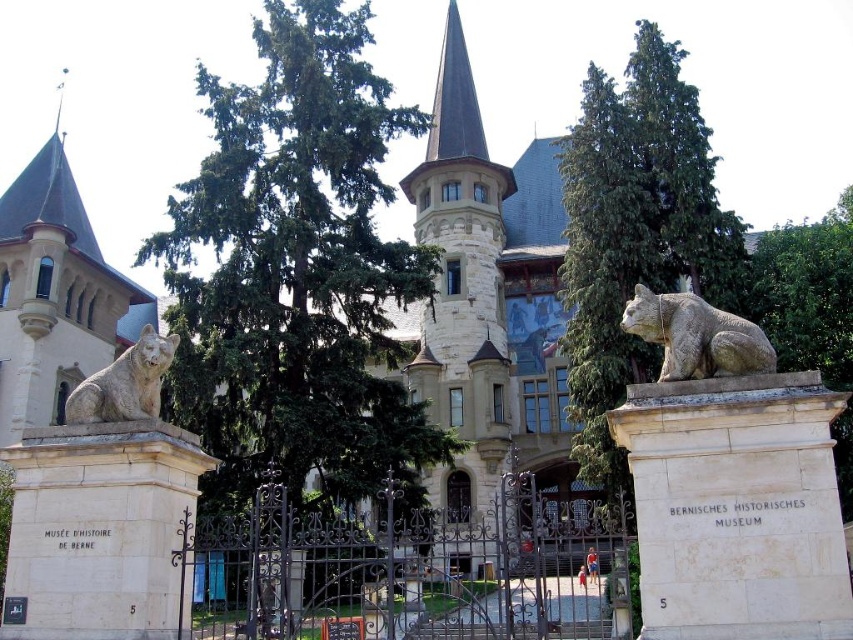
Does green leafy tree at upper right have a greater height compared to shiny dark gray spire at center?

Correct, green leafy tree at upper right is much taller as shiny dark gray spire at center.

Looking at this image, who is more forward, (799, 246) or (467, 74)?

Point (799, 246) is more forward.

Who is more distant from viewer, (778, 269) or (432, 113)?

The point (432, 113) is more distant.

Locate an element on the screen. The image size is (853, 640). green leafy tree at upper right is located at coordinates (807, 292).

This screenshot has height=640, width=853. Describe the element at coordinates (636, 232) in the screenshot. I see `green stone tree at center` at that location.

Is green stone tree at center taller than gray stone bear at left?

Yes, green stone tree at center is taller than gray stone bear at left.

Is point (602, 241) less distant than point (117, 364)?

That is False.

The width and height of the screenshot is (853, 640). What are the coordinates of `green stone tree at center` in the screenshot? It's located at (636, 232).

Between gray stone bear at left and shiny dark gray spire at center, which one is positioned lower?

gray stone bear at left

Between point (134, 358) and point (463, 93), which one is positioned behind?

Point (463, 93)

Where is `gray stone bear at left`? gray stone bear at left is located at coordinates (125, 384).